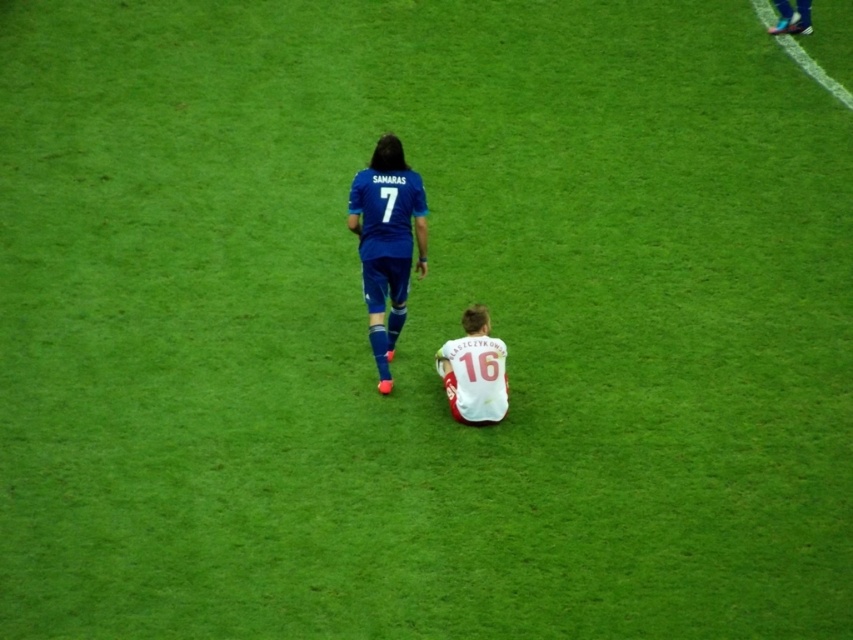
Question: Which point is closer to the camera?

Choices:
 (A) (358, 218)
 (B) (437, 358)

Answer: (B)

Question: Is blue matte soccer player at upper center positioned in front of white jersey at center?

Choices:
 (A) yes
 (B) no

Answer: (B)

Question: Which object is farther from the camera taking this photo?

Choices:
 (A) white jersey at center
 (B) blue matte soccer player at upper center

Answer: (B)

Question: Can you confirm if blue matte soccer player at upper center is positioned below white jersey at center?

Choices:
 (A) yes
 (B) no

Answer: (B)

Question: Is blue matte soccer player at upper center below white jersey at center?

Choices:
 (A) yes
 (B) no

Answer: (B)